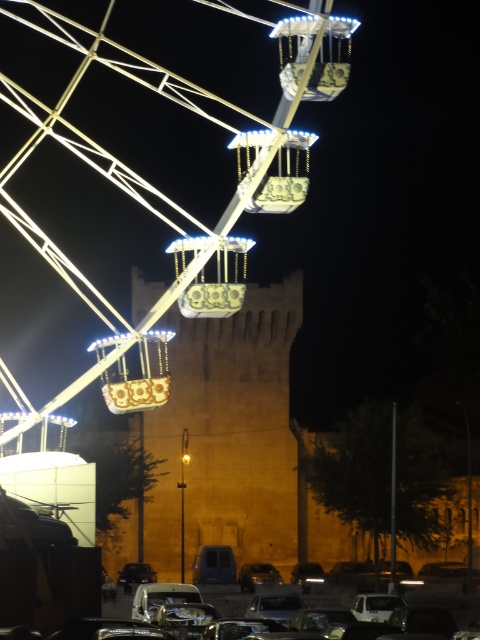
Can you confirm if shiny silver car at lower center is thinner than shiny black car at lower center?

No, shiny silver car at lower center is not thinner than shiny black car at lower center.

Is shiny silver car at lower center above shiny black car at lower center?

Indeed, shiny silver car at lower center is positioned over shiny black car at lower center.

Who is more forward, [276,595] or [148,576]?

Point [276,595] is more forward.

Find the location of a particular element. shiny silver car at lower center is located at coordinates (275, 605).

Between yellow stone tower at center and shiny silver car at center, which one appears on the left side from the viewer's perspective?

From the viewer's perspective, yellow stone tower at center appears more on the left side.

Is yellow stone tower at center wider than shiny silver car at center?

Correct, the width of yellow stone tower at center exceeds that of shiny silver car at center.

Measure the distance between yellow stone tower at center and camera.

A distance of 525.40 feet exists between yellow stone tower at center and camera.

The width and height of the screenshot is (480, 640). Find the location of `yellow stone tower at center`. yellow stone tower at center is located at coordinates (228, 435).

Describe the element at coordinates (228, 435) in the screenshot. I see `yellow stone tower at center` at that location.

Find the location of a particular element. This screenshot has height=640, width=480. yellow stone tower at center is located at coordinates (228, 435).